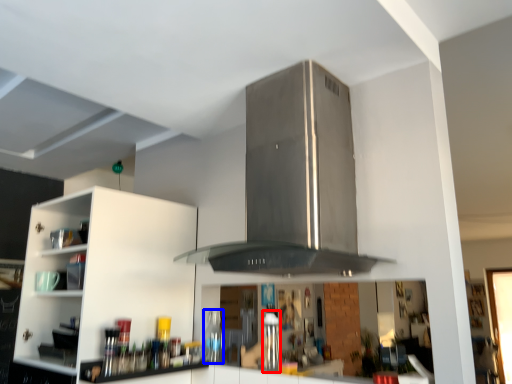
Question: Which object appears farthest to the camera in this image, appliance (highlighted by a red box) or bottle (highlighted by a blue box)?

Choices:
 (A) appliance
 (B) bottle

Answer: (B)